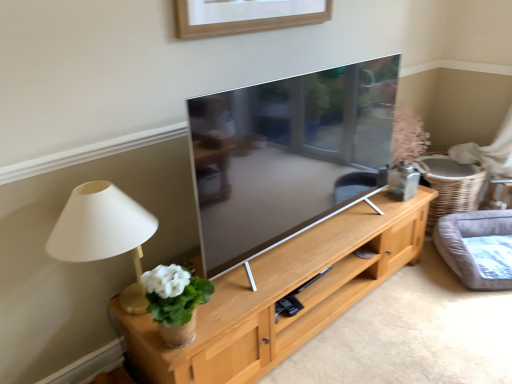
What do you see at coordinates (104, 232) in the screenshot? I see `matte beige lamp at left` at bounding box center [104, 232].

What do you see at coordinates (282, 296) in the screenshot? The image size is (512, 384). I see `light wood cabinet at center` at bounding box center [282, 296].

Identify the location of gray fabric cat bed at right. (478, 247).

The width and height of the screenshot is (512, 384). In order to click on white ceramic vase at left in this screenshot , I will do `click(175, 301)`.

Are gray fabric cat bed at right and matte beige lamp at left beside each other?

No, gray fabric cat bed at right is not next to matte beige lamp at left.

From the image's perspective, is gray fabric cat bed at right located above matte beige lamp at left?

Incorrect, from the image's perspective, gray fabric cat bed at right is lower than matte beige lamp at left.

What's the angular difference between gray fabric cat bed at right and matte beige lamp at left's facing directions?

The angle between the facing direction of gray fabric cat bed at right and the facing direction of matte beige lamp at left is 39 degrees.

Considering the relative sizes of gray fabric cat bed at right and matte beige lamp at left in the image provided, is gray fabric cat bed at right taller than matte beige lamp at left?

No, gray fabric cat bed at right is not taller than matte beige lamp at left.

Which object is further away from the camera taking this photo, gray fabric cat bed at right or light wood cabinet at center?

gray fabric cat bed at right.

Considering the sizes of objects gray fabric cat bed at right and light wood cabinet at center in the image provided, who is taller, gray fabric cat bed at right or light wood cabinet at center?

gray fabric cat bed at right.

From a real-world perspective, is gray fabric cat bed at right physically above light wood cabinet at center?

Yes, from a real-world perspective, gray fabric cat bed at right is above light wood cabinet at center.

In the scene shown: Is gray fabric cat bed at right inside or outside of light wood cabinet at center?

gray fabric cat bed at right cannot be found inside light wood cabinet at center.

Is matte beige lamp at left located outside white ceramic vase at left?

Indeed, matte beige lamp at left is completely outside white ceramic vase at left.

Does point (72, 242) come behind point (188, 279)?

No, it is not.

Is matte beige lamp at left aimed at white ceramic vase at left?

Yes, matte beige lamp at left is facing white ceramic vase at left.

Considering the positions of objects matte beige lamp at left and white ceramic vase at left in the image provided, who is in front, matte beige lamp at left or white ceramic vase at left?

matte beige lamp at left is in front.

Locate an element on the screen. This screenshot has width=512, height=384. table lamp to the left of white ceramic vase at left is located at coordinates (104, 232).

Which object is more forward, white ceramic vase at left or matte beige lamp at left?

matte beige lamp at left.

Are white ceramic vase at left and matte beige lamp at left located far from each other?

No, white ceramic vase at left is not far from matte beige lamp at left.

Which point is more forward, (165,292) or (110,236)?

The point (110,236) is in front.

Consider the image. Is light wood cabinet at center smaller than gray fabric cat bed at right?

No, light wood cabinet at center is not smaller than gray fabric cat bed at right.

From the image's perspective, is light wood cabinet at center positioned above or below gray fabric cat bed at right?

Based on their image positions, light wood cabinet at center is located beneath gray fabric cat bed at right.

Which object is more forward, light wood cabinet at center or gray fabric cat bed at right?

Positioned in front is light wood cabinet at center.

Considering the sizes of objects light wood cabinet at center and gray fabric cat bed at right in the image provided, who is taller, light wood cabinet at center or gray fabric cat bed at right?

Standing taller between the two is gray fabric cat bed at right.

Who is smaller, matte beige lamp at left or light wood cabinet at center?

matte beige lamp at left.

Is matte beige lamp at left turned away from light wood cabinet at center?

That's not correct — matte beige lamp at left is not looking away from light wood cabinet at center.

Is point (142, 313) less distant than point (332, 252)?

Yes, it is.

Does matte beige lamp at left have a lesser height compared to light wood cabinet at center?

No, matte beige lamp at left is not shorter than light wood cabinet at center.

Image resolution: width=512 pixels, height=384 pixels. I want to click on table lamp on the left of light wood cabinet at center, so click(x=104, y=232).

Is light wood cabinet at center taller or shorter than matte beige lamp at left?

Clearly, light wood cabinet at center is shorter compared to matte beige lamp at left.

Does point (294, 279) lie behind point (90, 251)?

Yes.

From the image's perspective, which object appears higher, light wood cabinet at center or matte beige lamp at left?

matte beige lamp at left, from the image's perspective.

You are a GUI agent. You are given a task and a screenshot of the screen. Output one action in this format:
    pyautogui.click(x=<x>, y=<y>)
    Task: Click on the cat bed behind the matte beige lamp at left
    The height and width of the screenshot is (384, 512).
    Given the screenshot: What is the action you would take?
    pyautogui.click(x=478, y=247)

Locate an element on the screen. This screenshot has width=512, height=384. cat bed that is above the light wood cabinet at center (from a real-world perspective) is located at coordinates (478, 247).

Considering their positions, is matte beige lamp at left positioned closer to light wood cabinet at center than gray fabric cat bed at right?

Based on the image, matte beige lamp at left appears to be nearer to light wood cabinet at center.

When comparing their distances from white ceramic vase at left, does light wood cabinet at center or matte beige lamp at left seem closer?

Based on the image, matte beige lamp at left appears to be nearer to white ceramic vase at left.

Considering their positions, is matte beige lamp at left positioned closer to white ceramic vase at left than light wood cabinet at center?

The object closer to white ceramic vase at left is matte beige lamp at left.

Based on the photo, when comparing their distances from light wood cabinet at center, does white ceramic vase at left or matte beige lamp at left seem further?

Among the two, matte beige lamp at left is located further to light wood cabinet at center.

Considering their positions, is matte beige lamp at left positioned further to gray fabric cat bed at right than white ceramic vase at left?

The object further to gray fabric cat bed at right is matte beige lamp at left.

Considering their positions, is white ceramic vase at left positioned further to gray fabric cat bed at right than matte beige lamp at left?

matte beige lamp at left is positioned further to the anchor gray fabric cat bed at right.

Looking at the image, which one is located further to matte beige lamp at left, gray fabric cat bed at right or white ceramic vase at left?

gray fabric cat bed at right lies further to matte beige lamp at left than the other object.

Looking at this image, estimate the real-world distances between objects in this image. Which object is closer to light wood cabinet at center, gray fabric cat bed at right or matte beige lamp at left?

The object closer to light wood cabinet at center is matte beige lamp at left.

Locate an element on the screen. shelf situated between white ceramic vase at left and gray fabric cat bed at right from left to right is located at coordinates (282, 296).

Find the location of a particular element. Image resolution: width=512 pixels, height=384 pixels. shelf located between matte beige lamp at left and gray fabric cat bed at right in the left-right direction is located at coordinates (282, 296).

Where is `houseplant between matte beige lamp at left and light wood cabinet at center in the horizontal direction`? The height and width of the screenshot is (384, 512). houseplant between matte beige lamp at left and light wood cabinet at center in the horizontal direction is located at coordinates (175, 301).

Find the location of a particular element. The height and width of the screenshot is (384, 512). houseplant located between matte beige lamp at left and gray fabric cat bed at right in the left-right direction is located at coordinates (175, 301).